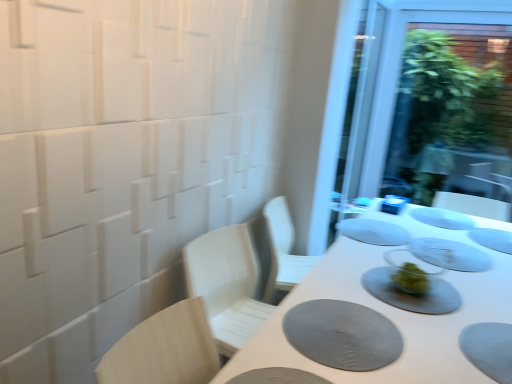
The width and height of the screenshot is (512, 384). Find the location of `free space above white matte table at center (from a real-world perspective)`. free space above white matte table at center (from a real-world perspective) is located at coordinates (421, 287).